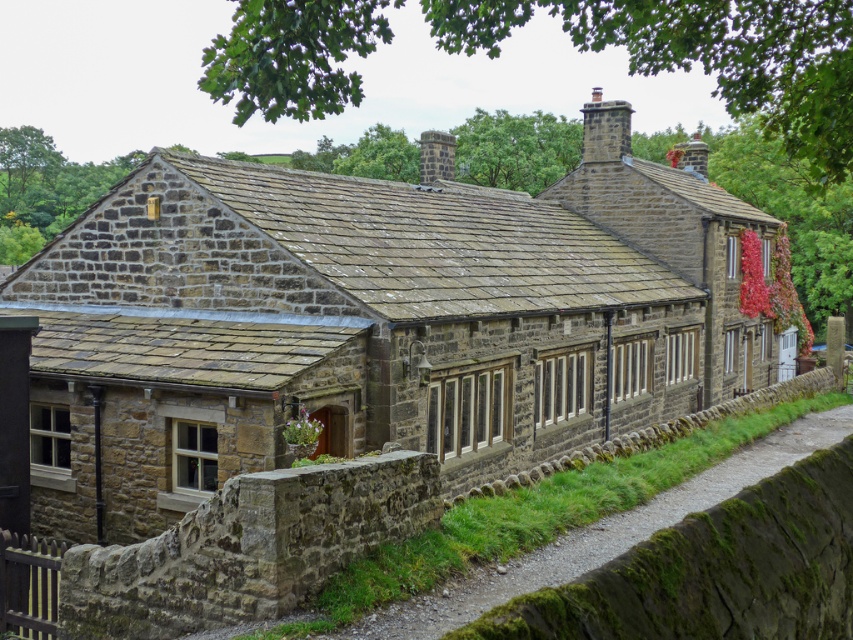
You are a GUI agent. You are given a task and a screenshot of the screen. Output one action in this format:
    pyautogui.click(x=<x>, y=<y>)
    Task: Click on the rustic stone cottage at center
    This screenshot has width=853, height=640.
    Given the screenshot: What is the action you would take?
    pyautogui.click(x=376, y=321)

From the picture: Is rustic stone cottage at center below mossy stone path at lower center?

Actually, rustic stone cottage at center is above mossy stone path at lower center.

The width and height of the screenshot is (853, 640). What are the coordinates of `rustic stone cottage at center` in the screenshot? It's located at (376, 321).